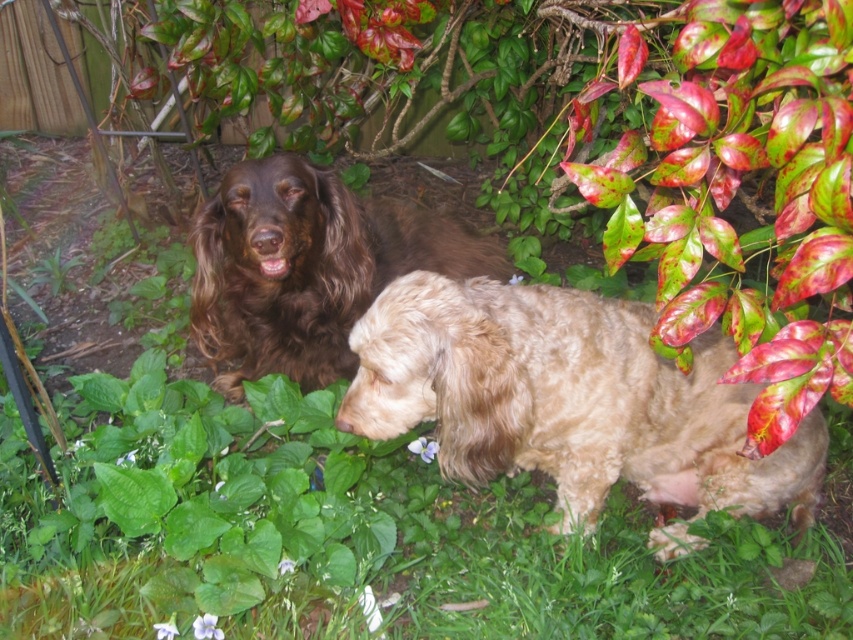
Question: Observing the image, what is the correct spatial positioning of light brown fur at center in reference to brown fluffy dog at center?

Choices:
 (A) right
 (B) left

Answer: (A)

Question: Among these points, which one is nearest to the camera?

Choices:
 (A) (723, 433)
 (B) (322, 307)

Answer: (A)

Question: Does light brown fur at center appear on the right side of brown fluffy dog at center?

Choices:
 (A) yes
 (B) no

Answer: (A)

Question: Which point is farther from the camera taking this photo?

Choices:
 (A) (399, 310)
 (B) (300, 333)

Answer: (B)

Question: Can you confirm if light brown fur at center is positioned to the right of brown fluffy dog at center?

Choices:
 (A) yes
 (B) no

Answer: (A)